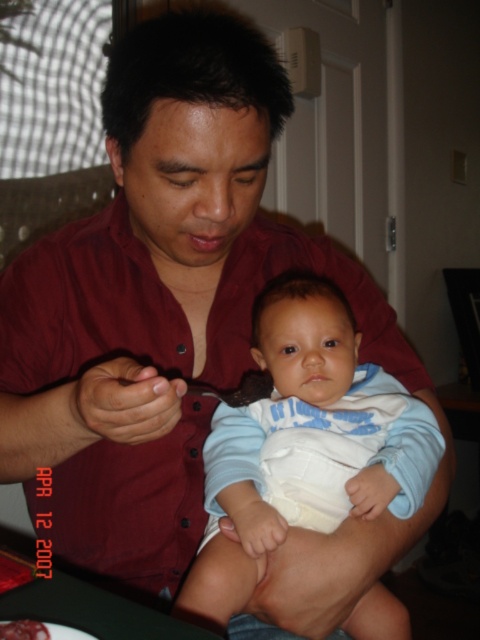
Question: Does light blue cotton onesie at center appear under smooth chocolate cake at center?

Choices:
 (A) yes
 (B) no

Answer: (B)

Question: Which of the following is the farthest from the observer?

Choices:
 (A) smooth chocolate cake at center
 (B) light blue cotton onesie at center

Answer: (B)

Question: Which object appears closest to the camera in this image?

Choices:
 (A) smooth chocolate cake at center
 (B) light blue cotton onesie at center

Answer: (A)

Question: From the image, what is the correct spatial relationship of light blue cotton onesie at center in relation to smooth chocolate cake at center?

Choices:
 (A) left
 (B) right

Answer: (B)

Question: Is the position of light blue cotton onesie at center less distant than that of smooth chocolate cake at center?

Choices:
 (A) yes
 (B) no

Answer: (B)

Question: Which point appears closest to the camera in this image?

Choices:
 (A) (9, 632)
 (B) (265, 301)

Answer: (A)